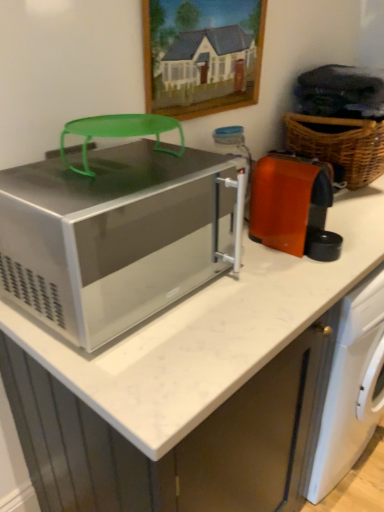
Question: Does woven brown basket at right have a greater height compared to white marble countertop at center?

Choices:
 (A) no
 (B) yes

Answer: (A)

Question: Would you say white marble countertop at center is part of woven brown basket at right's contents?

Choices:
 (A) no
 (B) yes

Answer: (A)

Question: From a real-world perspective, is woven brown basket at right positioned under white marble countertop at center based on gravity?

Choices:
 (A) no
 (B) yes

Answer: (A)

Question: Does woven brown basket at right turn towards white marble countertop at center?

Choices:
 (A) no
 (B) yes

Answer: (A)

Question: Is woven brown basket at right at the right side of white marble countertop at center?

Choices:
 (A) yes
 (B) no

Answer: (A)

Question: From their relative heights in the image, would you say satin silver microwave at center is taller or shorter than woven brown basket at right?

Choices:
 (A) short
 (B) tall

Answer: (A)

Question: Which is correct: satin silver microwave at center is inside woven brown basket at right, or outside of it?

Choices:
 (A) inside
 (B) outside

Answer: (B)

Question: From a real-world perspective, is satin silver microwave at center positioned above or below woven brown basket at right?

Choices:
 (A) above
 (B) below

Answer: (B)

Question: From the image's perspective, is satin silver microwave at center positioned above or below woven brown basket at right?

Choices:
 (A) below
 (B) above

Answer: (A)

Question: From a real-world perspective, is woven brown basket at right above or below satin silver microwave at center?

Choices:
 (A) above
 (B) below

Answer: (A)

Question: In terms of size, does woven brown basket at right appear bigger or smaller than satin silver microwave at center?

Choices:
 (A) small
 (B) big

Answer: (B)

Question: Is woven brown basket at right to the left or to the right of satin silver microwave at center in the image?

Choices:
 (A) right
 (B) left

Answer: (A)

Question: In terms of width, does woven brown basket at right look wider or thinner when compared to satin silver microwave at center?

Choices:
 (A) wide
 (B) thin

Answer: (B)

Question: In terms of size, does satin silver microwave at center appear bigger or smaller than white marble countertop at center?

Choices:
 (A) small
 (B) big

Answer: (A)

Question: From a real-world perspective, is satin silver microwave at center positioned above or below white marble countertop at center?

Choices:
 (A) above
 (B) below

Answer: (A)